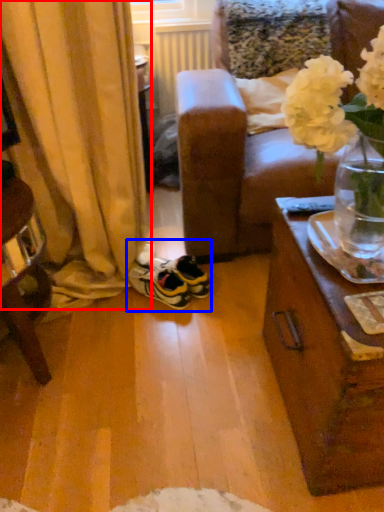
Question: Which point is closer to the camera, curtain (highlighted by a red box) or footwear (highlighted by a blue box)?

Choices:
 (A) curtain
 (B) footwear

Answer: (A)